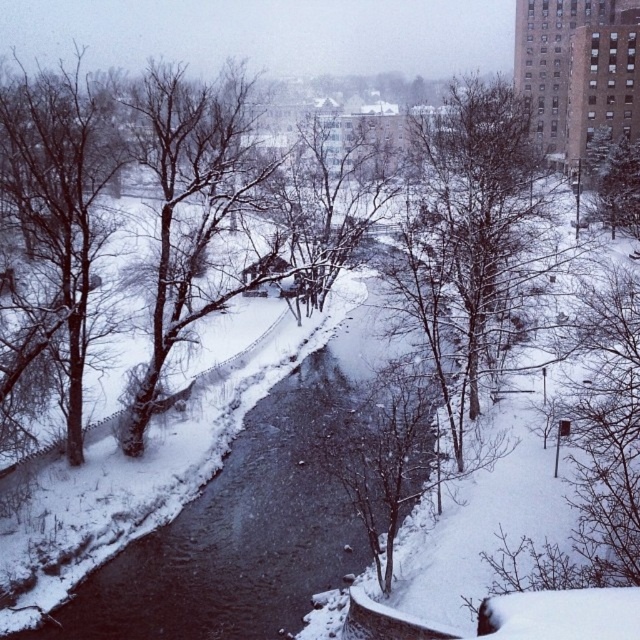
You are standing at the point with coordinates (244,524) in the winter scene. What is the object located at this point?

The point at coordinates (244,524) corresponds to the black ice river at center.

Looking at this image, you are standing on a snow path and want to cross to the other side of the black ice river at center. The bare branches at left are blocking your view. Can you see the buildings in the background while crossing the river?

The black ice river at center is in front of bare branches at left, so the branches are behind the river. Therefore, the buildings in the background would be visible beyond the river since the branches are not obstructing the view.

You are standing at the point closest to the bottom of the image and looking towards the river. Which of the two points, point [496,209] or point [195,301], is closer to your current position?

Point [195,301] is closer to your current position because it is in front of point [496,209].